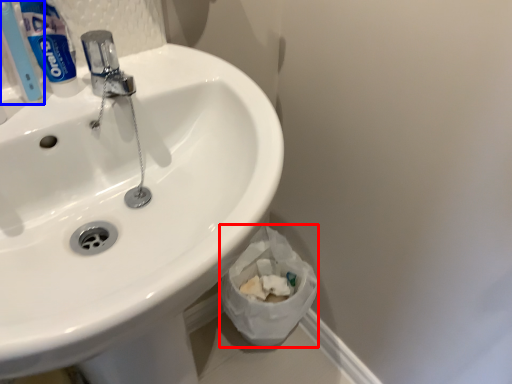
Question: Which point is closer to the camera, toilet paper (highlighted by a red box) or toothbrush (highlighted by a blue box)?

Choices:
 (A) toilet paper
 (B) toothbrush

Answer: (B)